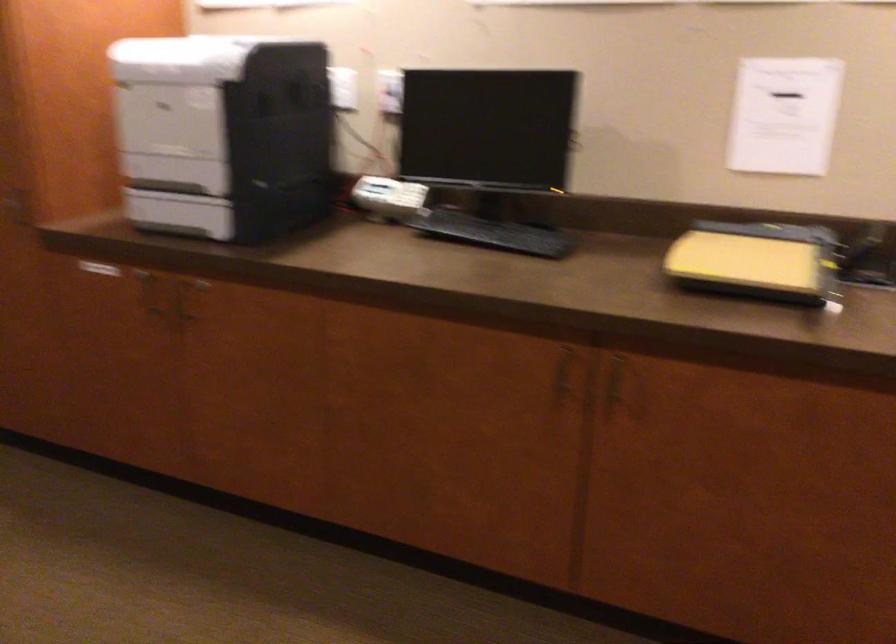
Where would you push the white telephone? Please return your answer as a coordinate pair (x, y).

(389, 196)